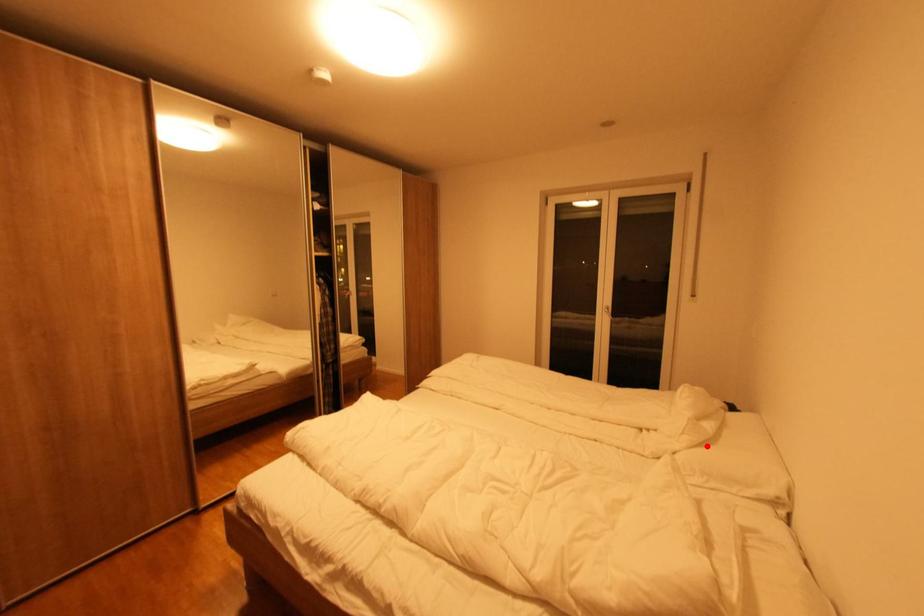
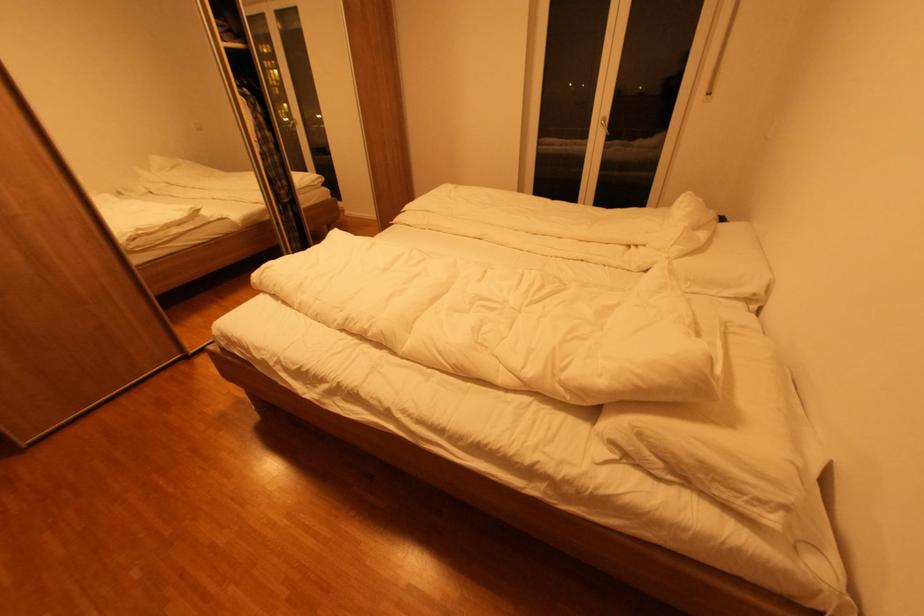
Question: I am providing you with two images of the same scene from different viewpoints. A red point is shown in image1. For the corresponding object point in image2, is it positioned nearer or farther from the camera?

Choices:
 (A) Nearer
 (B) Farther

Answer: (B)